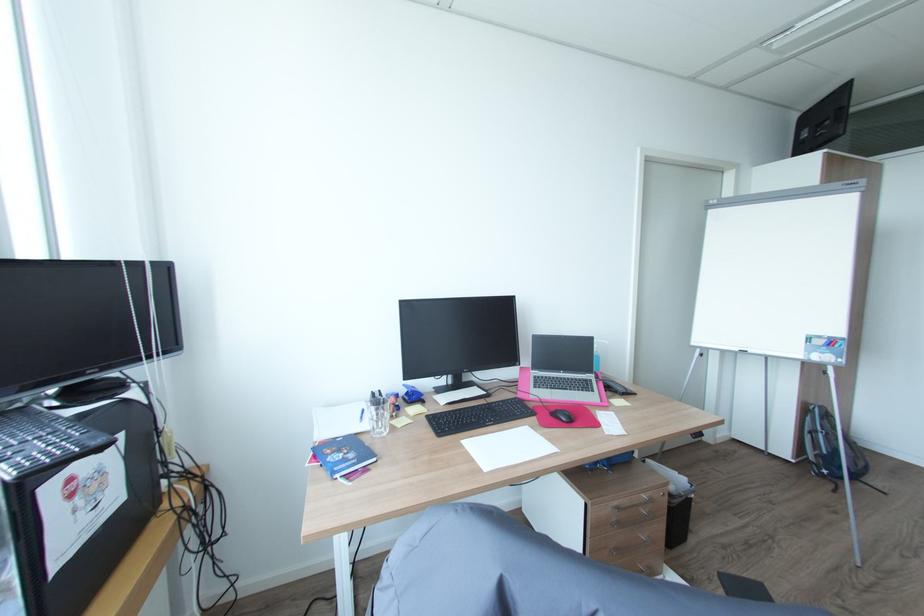
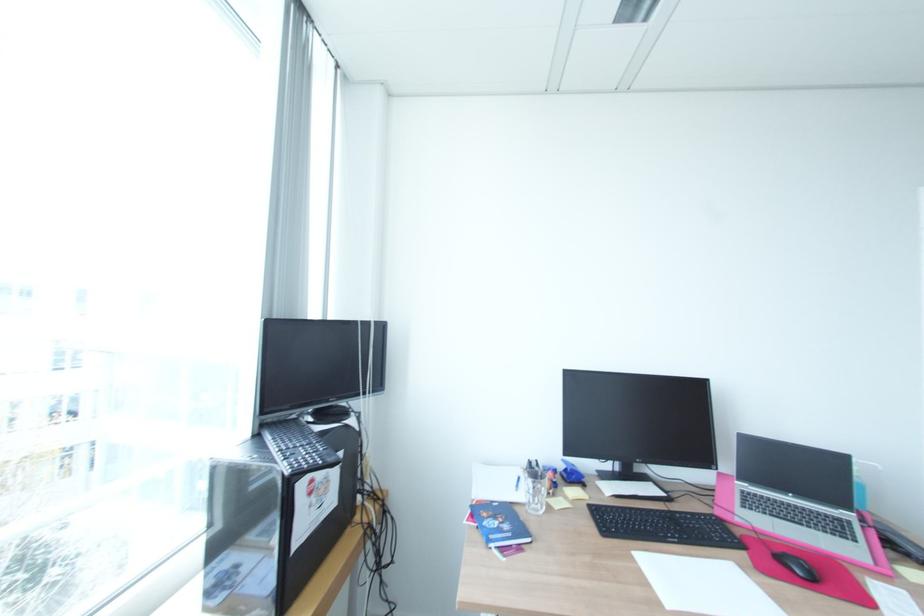
Locate, in the second image, the point that corresponds to [568,419] in the first image.

(804, 572)